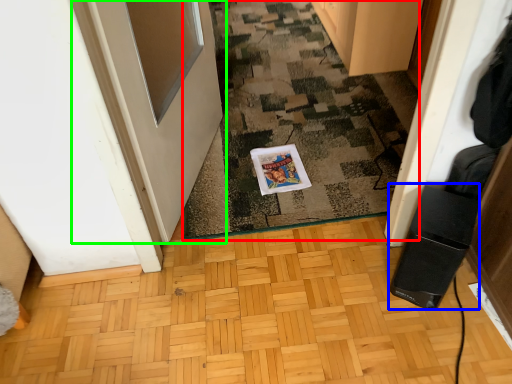
Question: Based on their relative distances, which object is farther from doormat (highlighted by a red box)? Choose from appliance (highlighted by a blue box) and door (highlighted by a green box).

Choices:
 (A) appliance
 (B) door

Answer: (A)